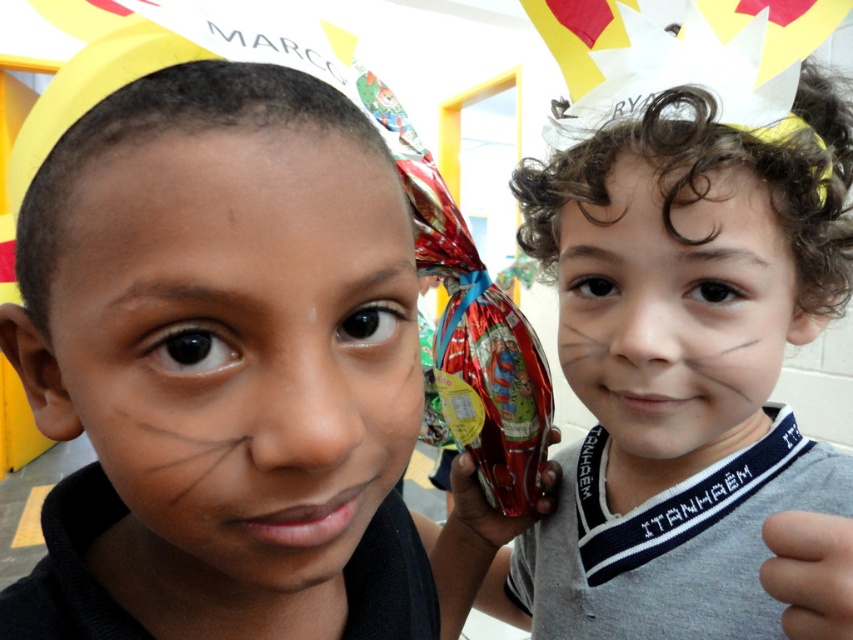
Question: Is matte black face at left above metallic shiny chocolate bar at center?

Choices:
 (A) no
 (B) yes

Answer: (B)

Question: Does matte black face at left appear under metallic shiny chocolate bar at center?

Choices:
 (A) yes
 (B) no

Answer: (B)

Question: Which of the following is the closest to the observer?

Choices:
 (A) skinny flesh at lower right
 (B) matte gray shirt at center
 (C) matte black face at left

Answer: (C)

Question: Which object is closer to the camera taking this photo?

Choices:
 (A) smooth skin face at right
 (B) matte gray shirt at center
 (C) metallic shiny chocolate bar at center

Answer: (B)

Question: Can you confirm if matte gray shirt at center is smaller than skinny flesh at lower right?

Choices:
 (A) no
 (B) yes

Answer: (A)

Question: Which point appears closest to the camera in this image?

Choices:
 (A) (761, 394)
 (B) (761, 566)

Answer: (B)